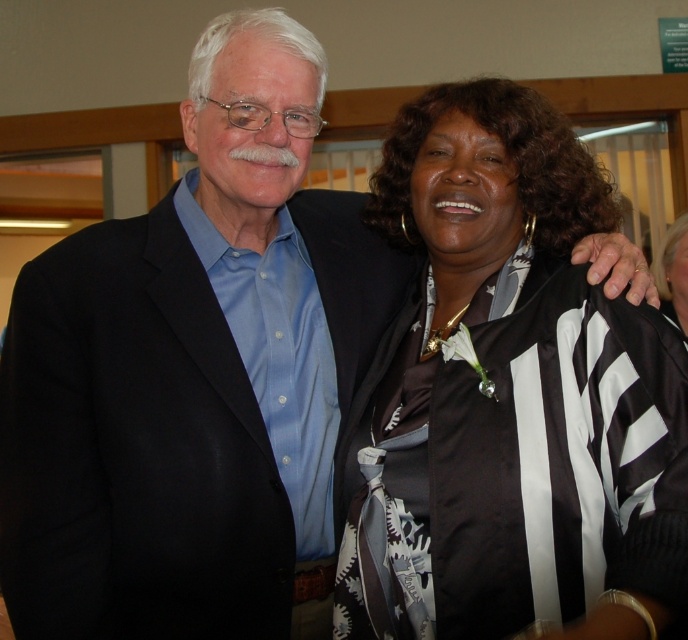
You are a photographer at the event and need to adjust the lighting to highlight the black satin suit at left. Since the point you marked is at coordinate [193,372], where exactly is the black satin suit at left located?

The point at coordinate [193,372] corresponds to the black satin suit at left, so the black satin suit at left is located at that coordinate.

You are standing at the point marked as point (225, 454) in the image. You want to hand a document to the woman in the black and white striped outfit. Can you reach her without moving from your current position?

The distance between you and the woman in the black and white striped outfit is 1.32 meters. Since you are 1.32 meters apart, you may need to extend your arm or use another method to reach her without moving from your current position.